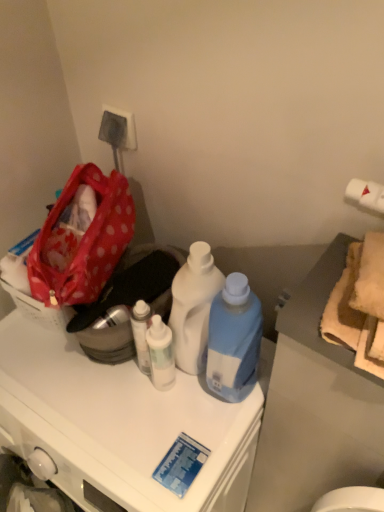
Image resolution: width=384 pixels, height=512 pixels. Identify the location of vacant space situated on the left part of white glossy bottle at center, acting as the 3th bottle starting from the right. 77,395.